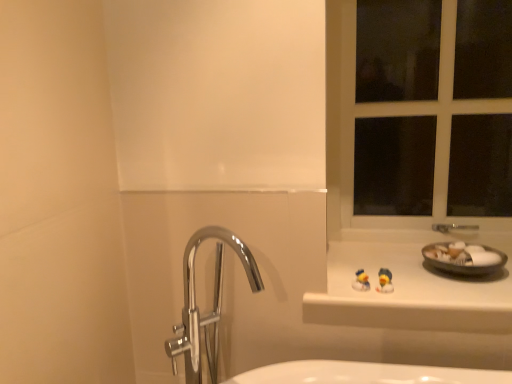
This screenshot has height=384, width=512. In order to click on blank space to the left of matte gray bowl at right in this screenshot , I will do `click(402, 276)`.